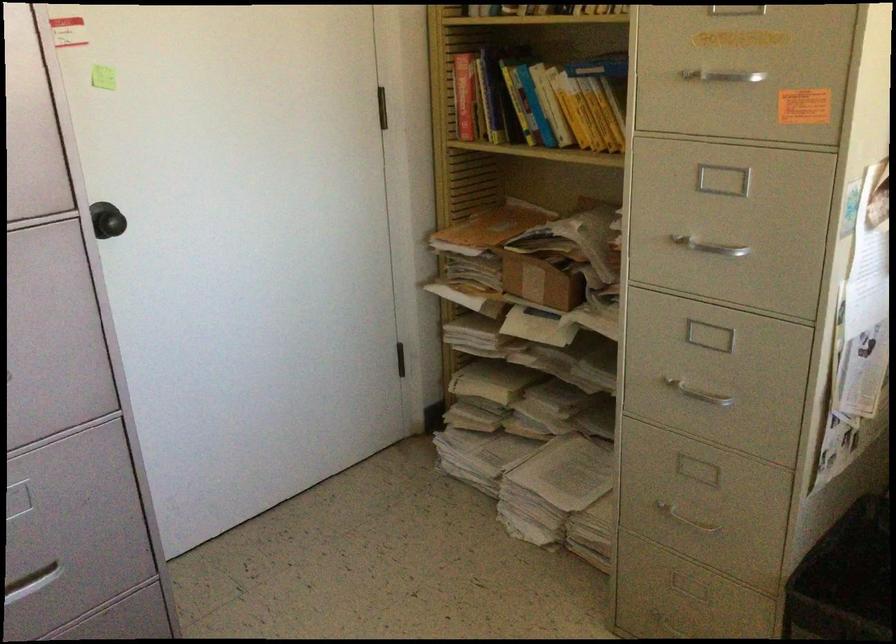
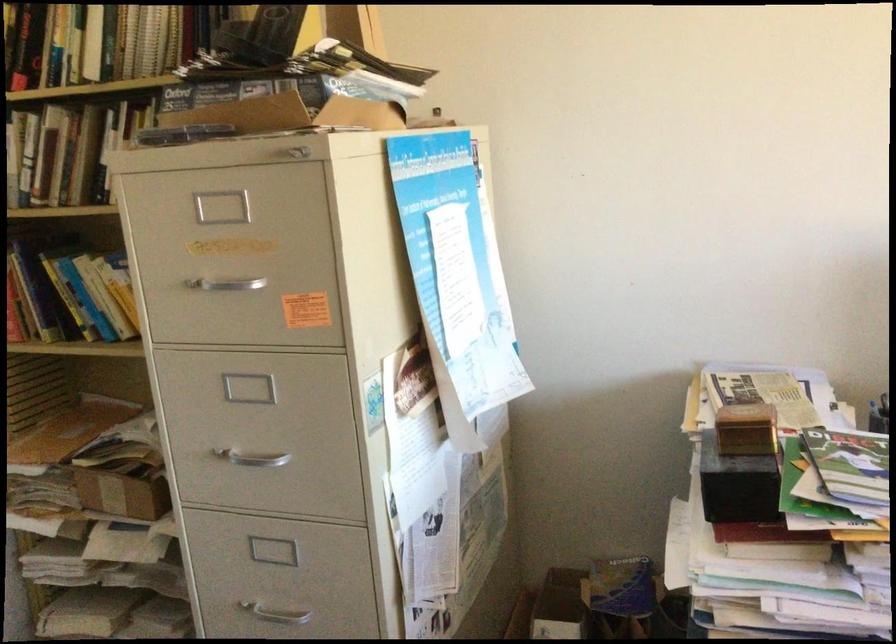
Find the pixel in the second image that matches (546,277) in the first image.

(123, 488)